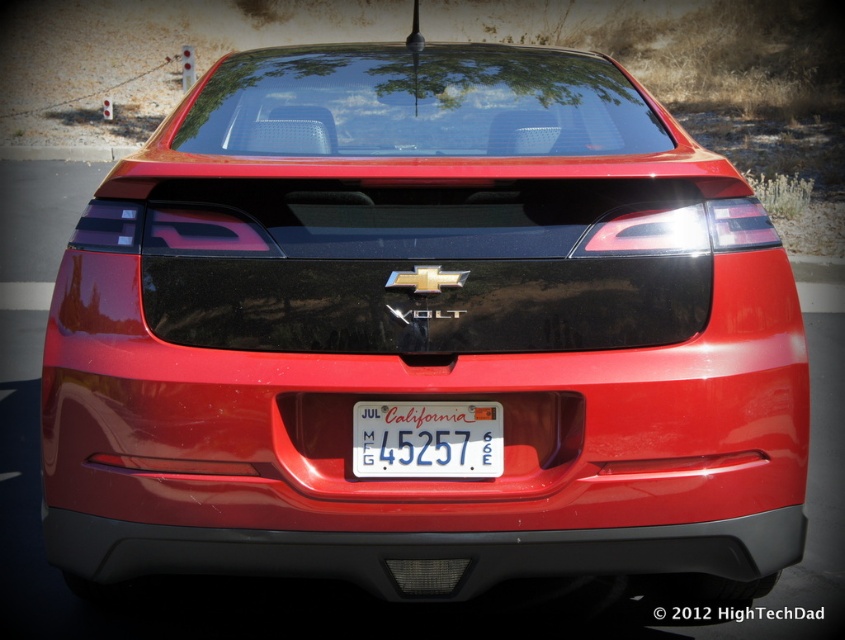
You are a parking attendant and need to guide a driver to align their car properly. The driver mentions they can only see the matte black bumper at lower center and the white plastic license plate at center. Which object should they adjust their position to align with the center of the parking space?

The driver should align with the white plastic license plate at center because the matte black bumper at lower center is to the left of it, meaning the bumper is offset and not centered.

Consider the image. You are a parking attendant and need to locate the matte black bumper at lower center on the car. Where would you look on the car?

The matte black bumper at lower center is located at point (424, 552) on the car.

You are a parking attendant and need to check the license plate of the white plastic license plate at center. You notice the matte black bumper at lower center is in the way. Can you determine if the bumper is larger than the license plate?

The matte black bumper at lower center has a larger size compared to the white plastic license plate at center, so yes, the bumper is larger than the license plate.